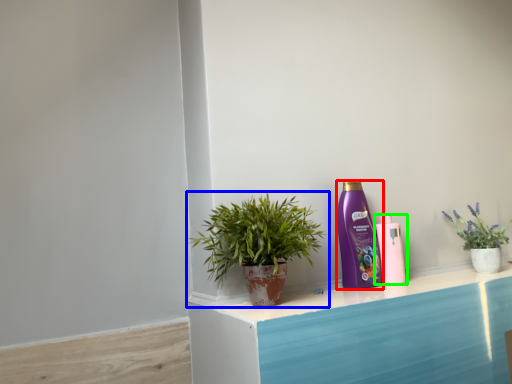
Question: Which object is the closest to the bottle (highlighted by a red box)? Choose among these: houseplant (highlighted by a blue box) or bottle (highlighted by a green box).

Choices:
 (A) houseplant
 (B) bottle

Answer: (B)